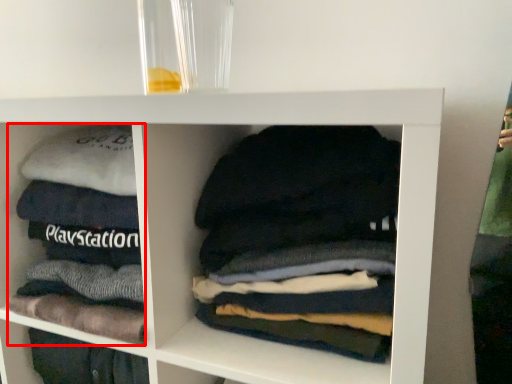
Question: From the image's perspective, considering the relative positions of material (annotated by the red box) and laundry in the image provided, where is material (annotated by the red box) located with respect to the staircase?

Choices:
 (A) below
 (B) above

Answer: (B)